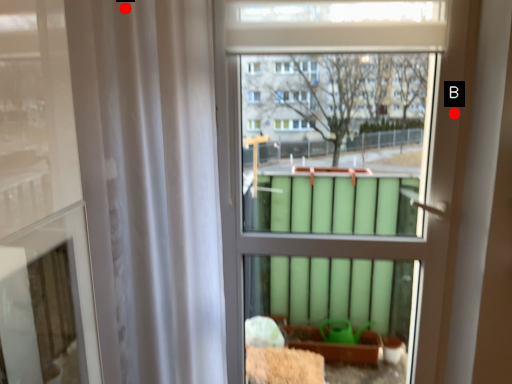
Question: Two points are circled on the image, labeled by A and B beside each circle. Which point is closer to the camera?

Choices:
 (A) A is closer
 (B) B is closer

Answer: (A)